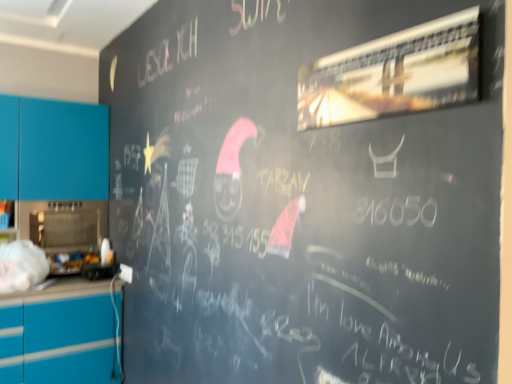
Question: Is the position of metallic reflective sign at upper right more distant than that of teal matte cabinet at left?

Choices:
 (A) yes
 (B) no

Answer: (B)

Question: Can you confirm if metallic reflective sign at upper right is positioned to the left of teal matte cabinet at left?

Choices:
 (A) yes
 (B) no

Answer: (B)

Question: From the image's perspective, is metallic reflective sign at upper right below teal matte cabinet at left?

Choices:
 (A) no
 (B) yes

Answer: (A)

Question: Is metallic reflective sign at upper right shorter than teal matte cabinet at left?

Choices:
 (A) yes
 (B) no

Answer: (A)

Question: Can you confirm if metallic reflective sign at upper right is taller than teal matte cabinet at left?

Choices:
 (A) no
 (B) yes

Answer: (A)

Question: Is metallic reflective sign at upper right oriented away from teal matte cabinet at left?

Choices:
 (A) no
 (B) yes

Answer: (A)

Question: From the image's perspective, is teal matte cabinet at left on metallic reflective sign at upper right?

Choices:
 (A) no
 (B) yes

Answer: (A)

Question: Does teal matte cabinet at left appear on the left side of metallic reflective sign at upper right?

Choices:
 (A) no
 (B) yes

Answer: (B)

Question: From a real-world perspective, is teal matte cabinet at left physically below metallic reflective sign at upper right?

Choices:
 (A) yes
 (B) no

Answer: (A)

Question: Is teal matte cabinet at left surrounding metallic reflective sign at upper right?

Choices:
 (A) no
 (B) yes

Answer: (A)

Question: Considering the relative sizes of teal matte cabinet at left and metallic reflective sign at upper right in the image provided, is teal matte cabinet at left bigger than metallic reflective sign at upper right?

Choices:
 (A) yes
 (B) no

Answer: (A)

Question: Is teal matte cabinet at left not near metallic reflective sign at upper right?

Choices:
 (A) yes
 (B) no

Answer: (A)

Question: From a real-world perspective, relative to metallic reflective sign at upper right, is teal matte cabinet at left vertically above or below?

Choices:
 (A) above
 (B) below

Answer: (B)